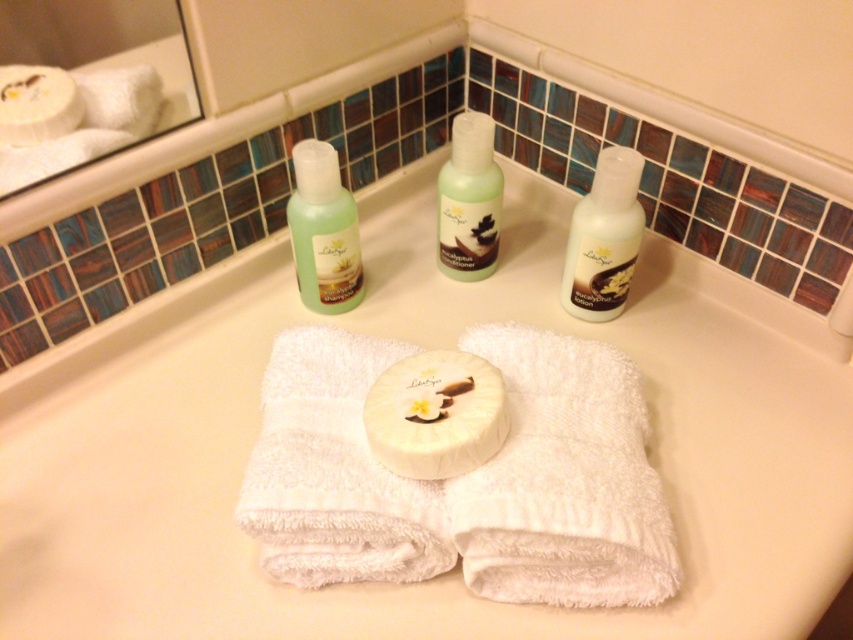
Question: Can you confirm if satin white lotion at right is bigger than translucent plastic bottle at center?

Choices:
 (A) yes
 (B) no

Answer: (B)

Question: Which point is farther to the camera?

Choices:
 (A) (321, 152)
 (B) (621, 253)
 (C) (454, 202)
 (D) (456, 364)

Answer: (C)

Question: Does white terry cloth towel at center lie in front of green translucent shampoo at upper center?

Choices:
 (A) yes
 (B) no

Answer: (A)

Question: Does white terry cloth towel at center appear on the left side of white matte soap at center?

Choices:
 (A) yes
 (B) no

Answer: (B)

Question: Which of these objects is positioned closest to the white matte soap at center?

Choices:
 (A) white terry cloth towel at center
 (B) satin white lotion at right

Answer: (A)

Question: Which object is farther from the camera taking this photo?

Choices:
 (A) white terry cloth towel at center
 (B) white matte soap at center
 (C) satin white lotion at right
 (D) translucent plastic bottle at center

Answer: (D)